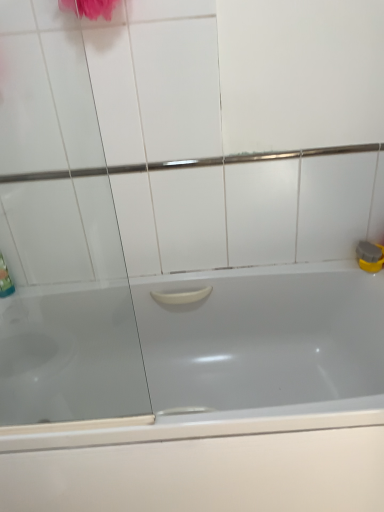
Question: Does point (62, 119) appear closer or farther from the camera than point (130, 458)?

Choices:
 (A) farther
 (B) closer

Answer: (A)

Question: Considering the positions of transparent glass screen door at left and white glossy bathtub at center in the image, is transparent glass screen door at left wider or thinner than white glossy bathtub at center?

Choices:
 (A) wide
 (B) thin

Answer: (B)

Question: Would you say transparent glass screen door at left is inside or outside white glossy bathtub at center?

Choices:
 (A) inside
 (B) outside

Answer: (B)

Question: In the image, is white glossy bathtub at center positioned in front of or behind transparent glass screen door at left?

Choices:
 (A) front
 (B) behind

Answer: (B)

Question: In terms of width, does white glossy bathtub at center look wider or thinner when compared to transparent glass screen door at left?

Choices:
 (A) wide
 (B) thin

Answer: (A)

Question: From the image's perspective, is white glossy bathtub at center located above or below transparent glass screen door at left?

Choices:
 (A) below
 (B) above

Answer: (A)

Question: Is point (332, 490) positioned closer to the camera than point (21, 389)?

Choices:
 (A) farther
 (B) closer

Answer: (B)